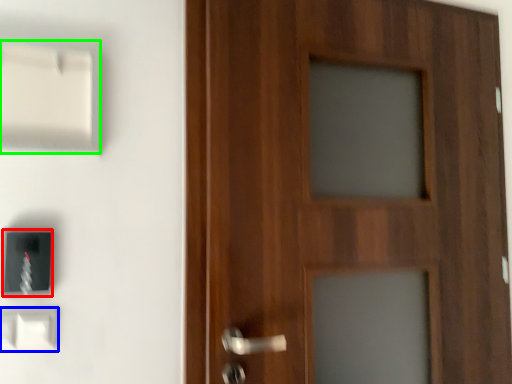
Question: Based on their relative distances, which object is nearer to light switch (highlighted by a red box)? Choose from light switch (highlighted by a blue box) and light switch (highlighted by a green box).

Choices:
 (A) light switch
 (B) light switch

Answer: (A)